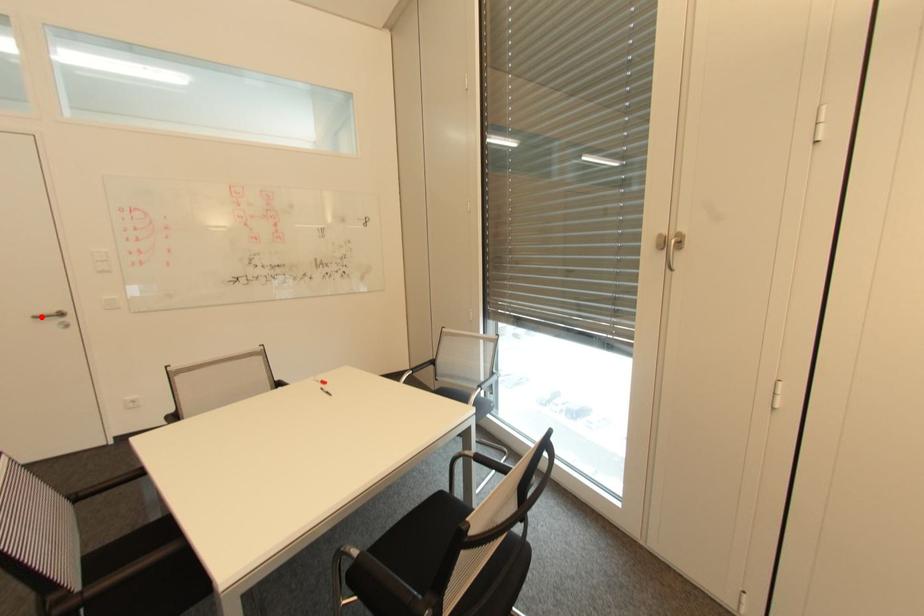
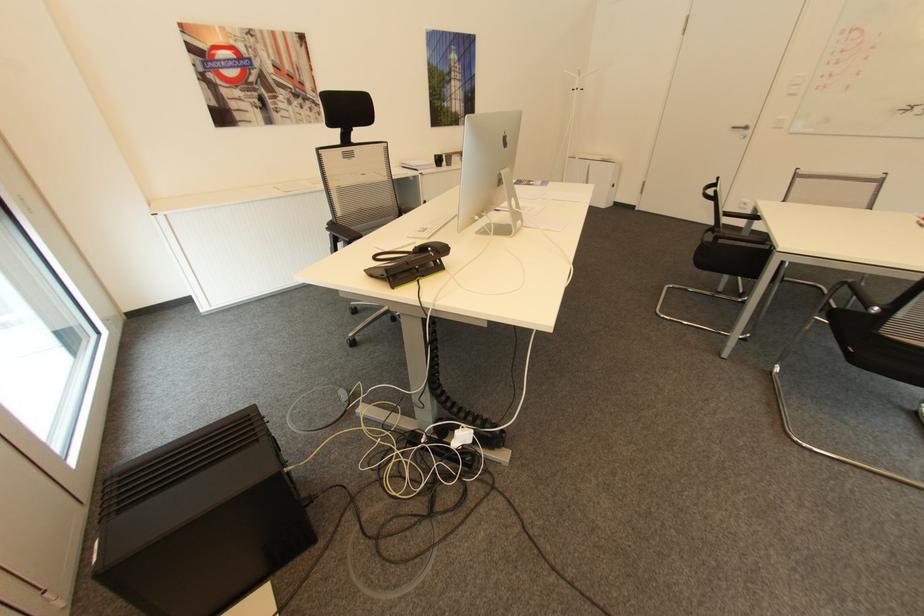
Find the pixel in the second image that matches the highlighted location in the first image.

(736, 128)